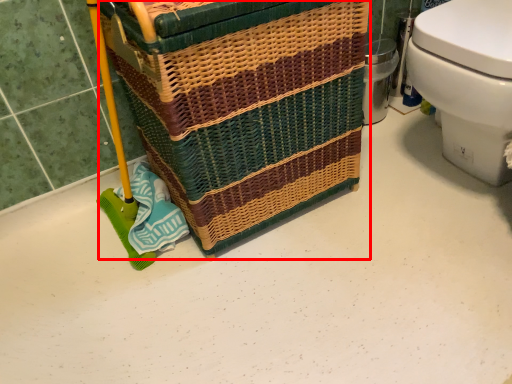
Question: In this image, where is basket container (annotated by the red box) located relative to toilet?

Choices:
 (A) right
 (B) left

Answer: (B)